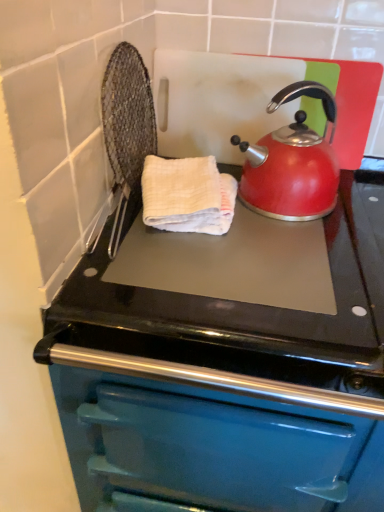
Question: Considering the positions of teal enamel oven at center and shiny red kettle at upper right in the image, is teal enamel oven at center bigger or smaller than shiny red kettle at upper right?

Choices:
 (A) big
 (B) small

Answer: (A)

Question: Is teal enamel oven at center taller or shorter than shiny red kettle at upper right?

Choices:
 (A) short
 (B) tall

Answer: (B)

Question: Which object is the closest to the white textured hand towel at center?

Choices:
 (A) teal enamel oven at center
 (B) shiny red kettle at upper right

Answer: (B)

Question: Which of these objects is positioned farthest from the teal enamel oven at center?

Choices:
 (A) shiny red kettle at upper right
 (B) white textured hand towel at center

Answer: (A)